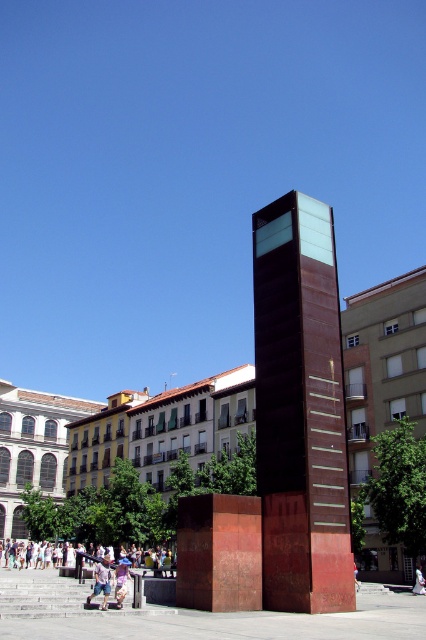
You are a photographer aiming to capture the light purple cotton dress at lower center and the light brown wooden bench at lower center in a single shot. Which object should you focus on first to ensure both are in frame?

You should focus on the light brown wooden bench at lower center first because the light purple cotton dress at lower center is in front of it, so adjusting the focus starting from the closer object will help capture both in the frame.

You are an urban planner evaluating the space between the rustic metal tower at center and the light brown wooden bench at lower center. Based on their sizes, which object would require more space to accommodate in a redesign of this area?

The rustic metal tower at center is bigger than the light brown wooden bench at lower center, so it would require more space to accommodate in the redesign.

You are standing in the urban scene and want to walk from the point at coordinates point (313, 358) to the point at coordinates point (95, 557). Since the sculpture is in the way, will you need to go around it?

Point (313, 358) is in front of point (95, 557), so the sculpture is between them. Therefore, you will need to go around it to reach your destination.